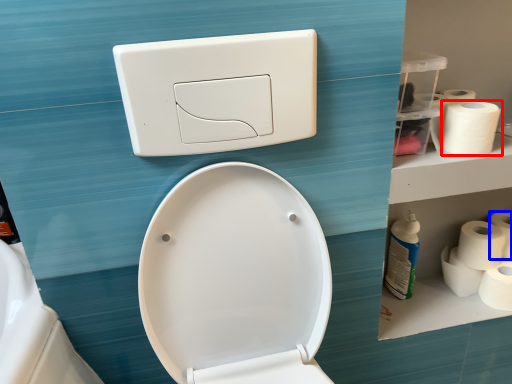
Question: Which point is further to the camera, toilet paper (highlighted by a red box) or toilet paper (highlighted by a blue box)?

Choices:
 (A) toilet paper
 (B) toilet paper

Answer: (B)